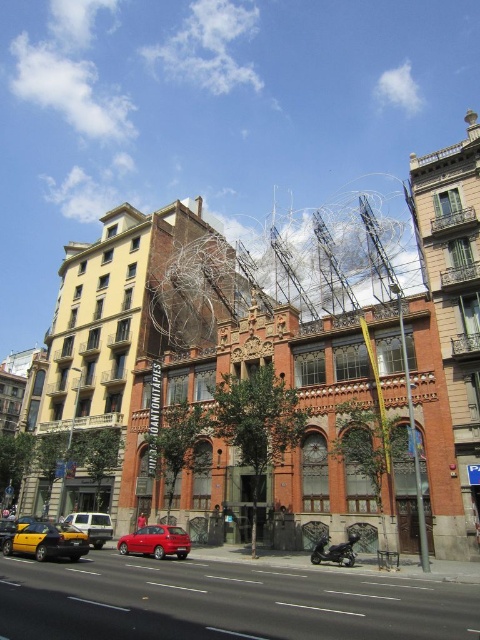
You are a pedestrian standing on the street and want to cross to the other side. There is a shiny red sedan at center and a matte silver van at center. Which vehicle should you avoid stepping on first?

The shiny red sedan at center is located above the matte silver van at center, so you should avoid stepping on the shiny red sedan at center first since it is closer to you.

You are standing at a point 38.69 meters away from the camera. Based on the scene description, which object from the list is closest to your current position? Please choose between the point at (x=73, y=529) and the camera.

The point at (x=73, y=529) is 38.69 meters away from the camera, so the camera is closer to your current position than the point at (x=73, y=529).